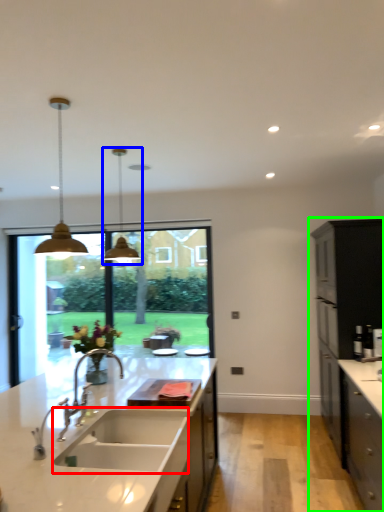
Question: Which object is the closest to the sink (highlighted by a red box)? Choose among these: light fixture (highlighted by a blue box) or cabinetry (highlighted by a green box).

Choices:
 (A) light fixture
 (B) cabinetry

Answer: (A)